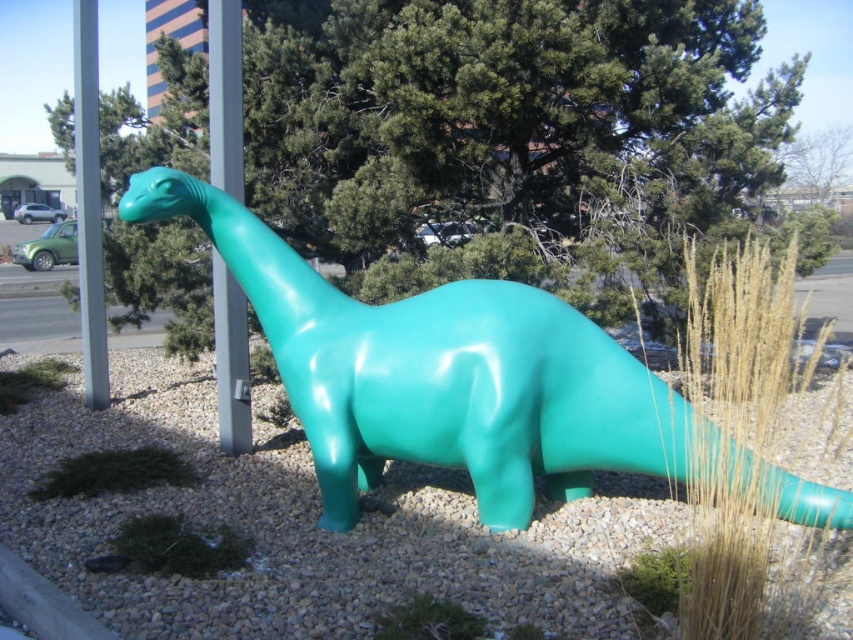
Who is more distant from viewer, (239, 476) or (581, 476)?

Positioned behind is point (239, 476).

You are a GUI agent. You are given a task and a screenshot of the screen. Output one action in this format:
    pyautogui.click(x=<x>, y=<y>)
    Task: Click on the green glossy dinosaur at center
    The image size is (853, 640).
    Given the screenshot: What is the action you would take?
    pyautogui.click(x=306, y=528)

Which is below, glossy plastic dinosaur at center or metallic gray pole at upper center?

glossy plastic dinosaur at center is lower down.

Is point (474, 460) more distant than point (222, 323)?

No.

Image resolution: width=853 pixels, height=640 pixels. Find the location of `glossy plastic dinosaur at center`. glossy plastic dinosaur at center is located at coordinates (440, 374).

Is green glossy dinosaur at center bigger than metallic gray pole at upper left?

Correct, green glossy dinosaur at center is larger in size than metallic gray pole at upper left.

Which is more to the left, green glossy dinosaur at center or metallic gray pole at upper left?

metallic gray pole at upper left

Who is more forward, (570, 600) or (85, 205)?

Point (570, 600) is in front.

Image resolution: width=853 pixels, height=640 pixels. In order to click on green glossy dinosaur at center in this screenshot , I will do `click(306, 528)`.